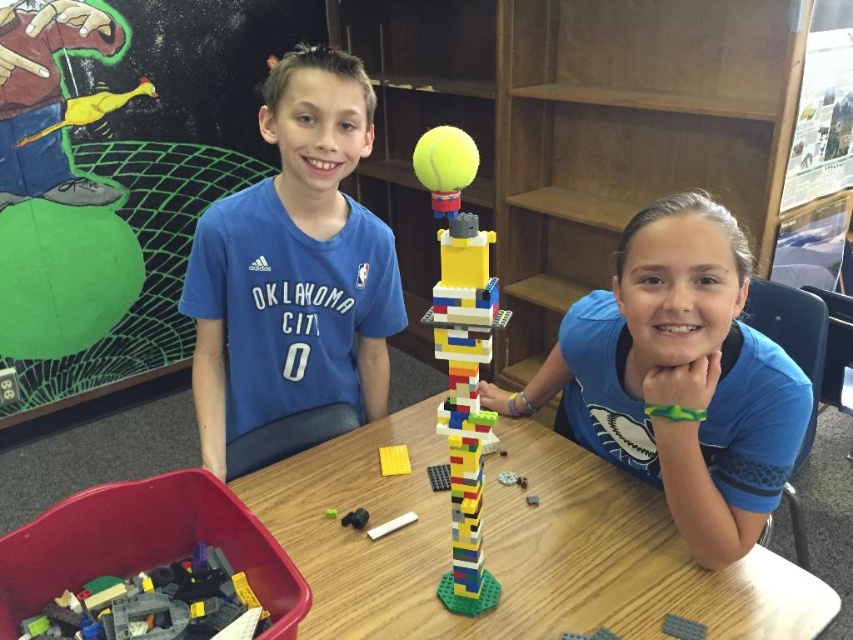
Question: Is blue matte shirt at center to the right of yellow matte rubber duck at upper left from the viewer's perspective?

Choices:
 (A) no
 (B) yes

Answer: (B)

Question: Based on their relative distances, which object is farther from the yellow matte square at center?

Choices:
 (A) wooden table at center
 (B) translucent gray plastic bricks at lower left
 (C) white matte stick at center

Answer: (B)

Question: Which point is farther to the camera?

Choices:
 (A) blue jersey at center
 (B) white matte stick at center

Answer: (A)

Question: Is wooden table at center above yellow matte lego tower at center?

Choices:
 (A) no
 (B) yes

Answer: (A)

Question: Is blue jersey at center smaller than matte black plastic block at center?

Choices:
 (A) yes
 (B) no

Answer: (B)

Question: Which object appears farthest from the camera in this image?

Choices:
 (A) yellow matte lego tower at center
 (B) translucent gray plastic bricks at lower left
 (C) yellow matte square at center

Answer: (C)